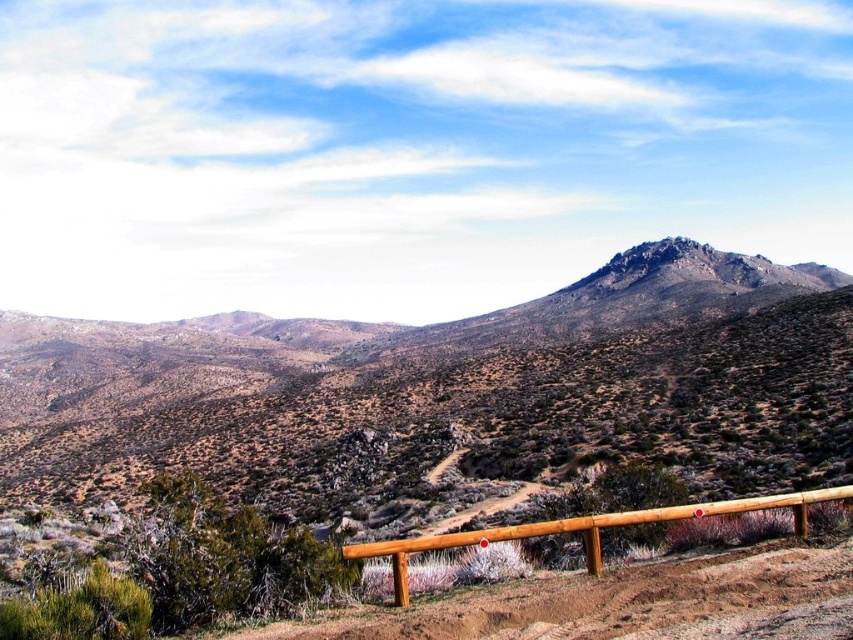
You are a hiker standing at the start of the dirt path bordered by the brown wooden rail at lower center. You want to reach the brown textured hill at center. Which direction should you walk to get closer to the hill?

The brown textured hill at center is wider than the brown wooden rail at lower center, so you should walk forward along the dirt path bordered by the brown wooden rail at lower center to approach the hill.

You are a hiker planning to cross the brown dirt track at center. There is a brown textured hill at center nearby. Which one is higher, the hill or the track?

The brown textured hill at center is higher than the brown dirt track at center according to the description.